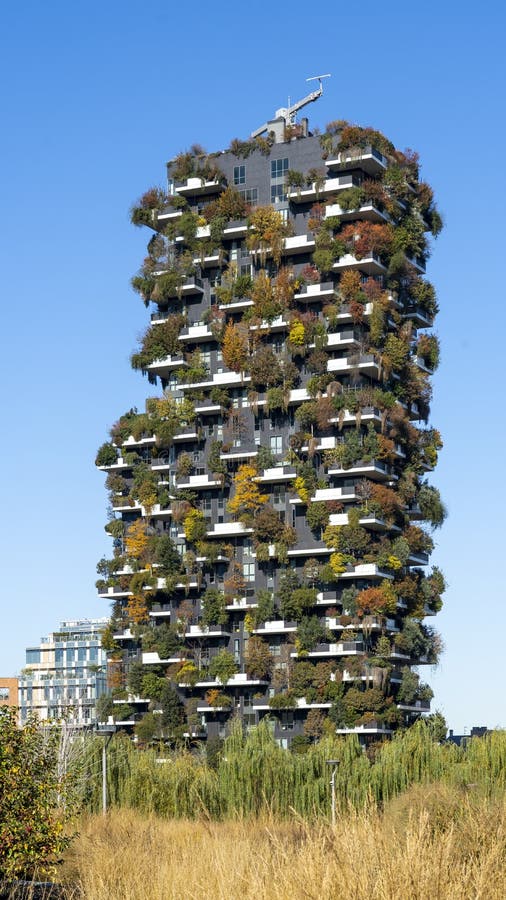
You are a GUI agent. You are given a task and a screenshot of the screen. Output one action in this format:
    pyautogui.click(x=<x>, y=<y>)
    Task: Click on the chimney
    
    Given the screenshot: What is the action you would take?
    pyautogui.click(x=448, y=729)